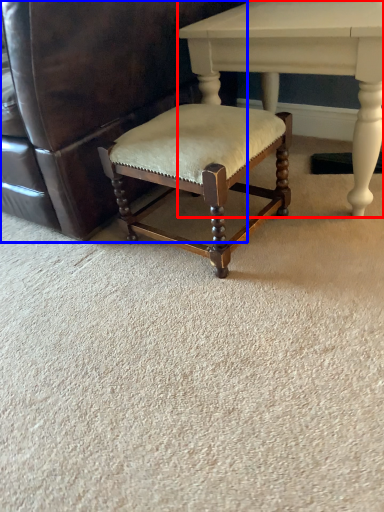
Question: Which object is further to the camera taking this photo, table (highlighted by a red box) or chair (highlighted by a blue box)?

Choices:
 (A) table
 (B) chair

Answer: (A)